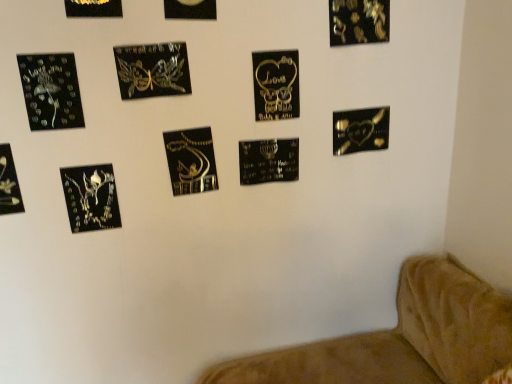
Question: Considering the positions of point (252, 76) and point (180, 44), is point (252, 76) closer or farther from the camera than point (180, 44)?

Choices:
 (A) closer
 (B) farther

Answer: (B)

Question: Is black metallic plaque at center, placed as the third picture frame when sorted from right to left, to the left or to the right of metallic gold butterfly at upper center, marked as the fifth picture frame in a left-to-right arrangement, in the image?

Choices:
 (A) right
 (B) left

Answer: (A)

Question: Which is nearer to the black glossy heart at lower right, placed as the 11th picture frame when sorted from left to right?

Choices:
 (A) matte black bookmark at lower left, marked as the eleventh picture frame in a right-to-left arrangement
 (B) black glossy picture frame at lower left, which ranks as the 9th picture frame in right-to-left order
 (C) metallic gold picture frame at upper left, positioned as the 4th picture frame in left-to-right order
 (D) metallic gold necklace at center, which is the sixth picture frame from right to left
 (E) black metallic plaque at center, positioned as the ninth picture frame in left-to-right order

Answer: (E)

Question: Which of these objects is positioned closest to the metallic gold butterfly at upper center, placed as the 7th picture frame when sorted from right to left?

Choices:
 (A) matte black bookmark at lower left, the 1th picture frame in the left-to-right sequence
 (B) metallic gold picture frame at upper left, marked as the 8th picture frame in a right-to-left arrangement
 (C) black glossy heart at lower right, which is the 1th picture frame in right-to-left order
 (D) black glossy picture frame at lower left, which is counted as the 3th picture frame, starting from the left
 (E) black glossy picture frame at upper right, which appears as the tenth picture frame when viewed from the left

Answer: (B)